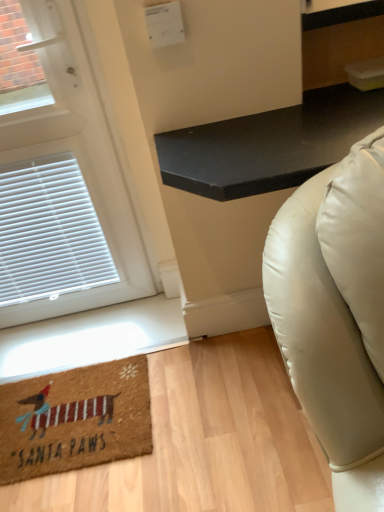
Question: Can you confirm if black matte table at upper right is wider than white matte door at upper left?

Choices:
 (A) yes
 (B) no

Answer: (A)

Question: Does black matte table at upper right appear on the right side of white matte door at upper left?

Choices:
 (A) yes
 (B) no

Answer: (A)

Question: Is black matte table at upper right touching white matte door at upper left?

Choices:
 (A) yes
 (B) no

Answer: (B)

Question: Considering the relative sizes of black matte table at upper right and white matte door at upper left in the image provided, is black matte table at upper right taller than white matte door at upper left?

Choices:
 (A) yes
 (B) no

Answer: (B)

Question: Considering the relative sizes of black matte table at upper right and white matte door at upper left in the image provided, is black matte table at upper right shorter than white matte door at upper left?

Choices:
 (A) no
 (B) yes

Answer: (B)

Question: Considering the relative positions of white matte door at upper left and black matte table at upper right in the image provided, is white matte door at upper left to the left or to the right of black matte table at upper right?

Choices:
 (A) right
 (B) left

Answer: (B)

Question: Relative to black matte table at upper right, is white matte door at upper left in front or behind?

Choices:
 (A) front
 (B) behind

Answer: (B)

Question: From their relative heights in the image, would you say white matte door at upper left is taller or shorter than black matte table at upper right?

Choices:
 (A) short
 (B) tall

Answer: (B)

Question: In terms of width, does white matte door at upper left look wider or thinner when compared to black matte table at upper right?

Choices:
 (A) thin
 (B) wide

Answer: (A)

Question: Based on their sizes in the image, would you say white matte door at upper left is bigger or smaller than brown coir mat at lower left?

Choices:
 (A) small
 (B) big

Answer: (B)

Question: From their relative heights in the image, would you say white matte door at upper left is taller or shorter than brown coir mat at lower left?

Choices:
 (A) short
 (B) tall

Answer: (B)

Question: In the image, is white matte door at upper left positioned in front of or behind brown coir mat at lower left?

Choices:
 (A) front
 (B) behind

Answer: (A)

Question: Is point (134, 245) positioned closer to the camera than point (74, 430)?

Choices:
 (A) closer
 (B) farther

Answer: (B)

Question: Is black matte table at upper right wider or thinner than brown coir mat at lower left?

Choices:
 (A) wide
 (B) thin

Answer: (A)

Question: From a real-world perspective, relative to brown coir mat at lower left, is black matte table at upper right vertically above or below?

Choices:
 (A) below
 (B) above

Answer: (B)